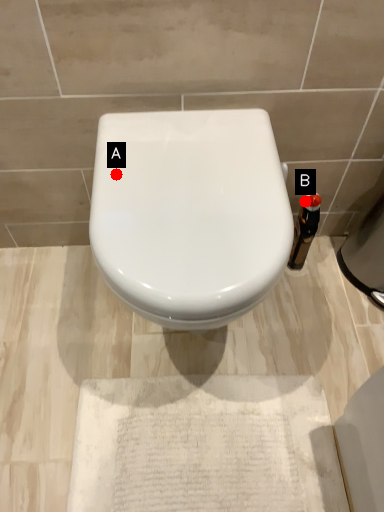
Question: Two points are circled on the image, labeled by A and B beside each circle. Which point is farther from the camera taking this photo?

Choices:
 (A) A is further
 (B) B is further

Answer: (B)